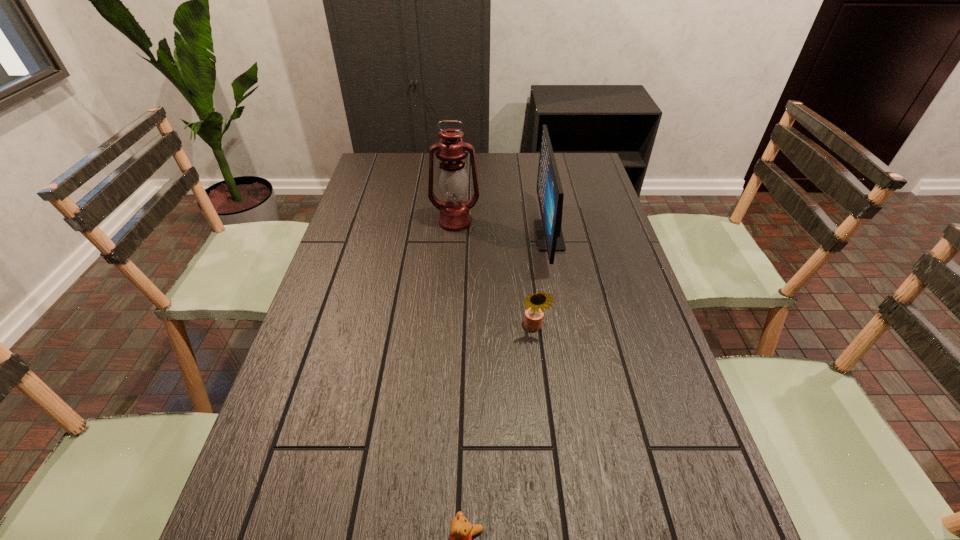
Identify the location of free space that satisfies the following two spatial constraints: 1. on the screen side of the third shortest object; 2. on the face of the sunflower. The width and height of the screenshot is (960, 540). click(x=566, y=327).

Where is `vacant space that satisfies the following two spatial constraints: 1. on the screen side of the rightmost object; 2. on the face of the second object from right to left`? The height and width of the screenshot is (540, 960). vacant space that satisfies the following two spatial constraints: 1. on the screen side of the rightmost object; 2. on the face of the second object from right to left is located at coordinates (566, 327).

Identify the location of free space that satisfies the following two spatial constraints: 1. on the screen side of the second tallest object; 2. on the face of the second shortest object. tap(566, 327).

Identify the location of free spot that satisfies the following two spatial constraints: 1. on the screen side of the computer monitor; 2. on the face of the second object from right to left. This screenshot has width=960, height=540. (566, 327).